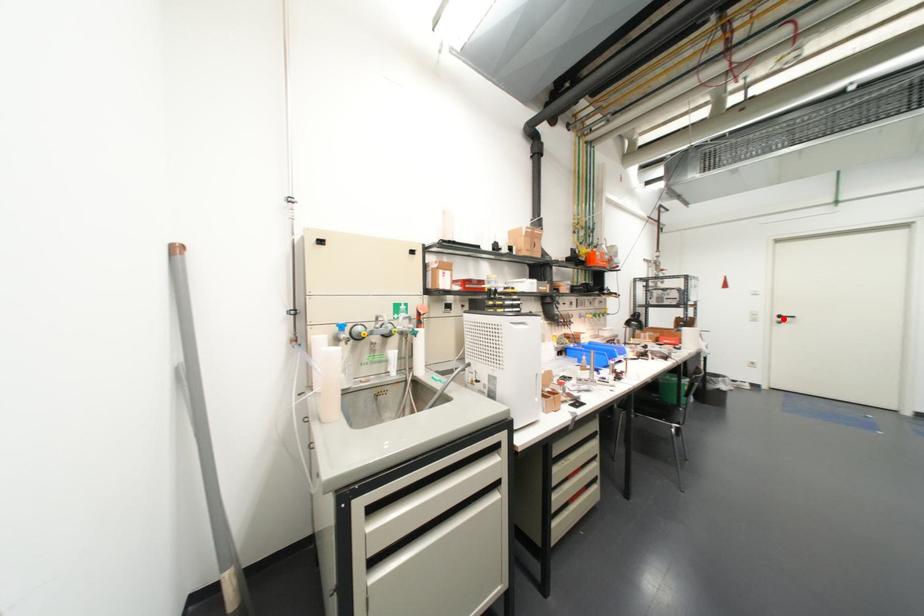
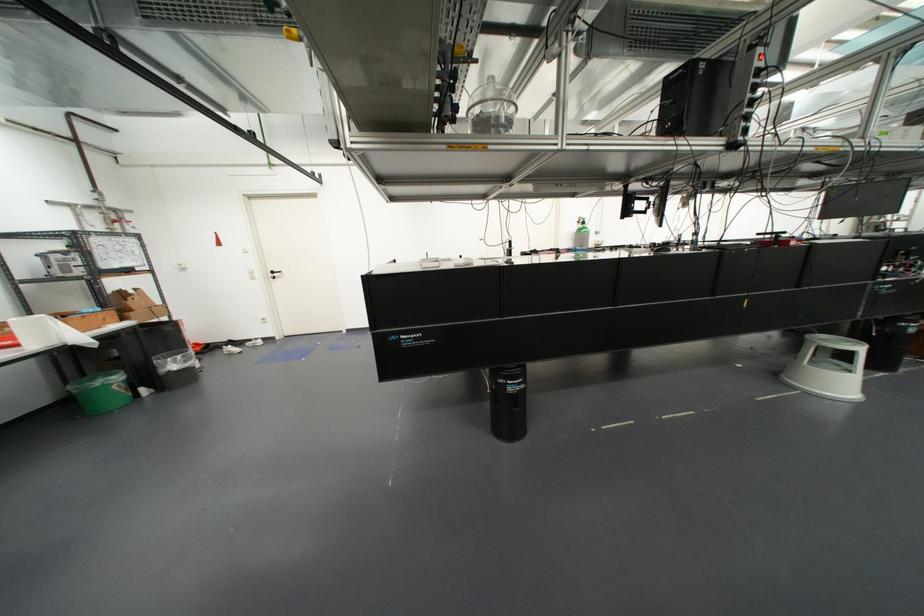
Where in the second image is the point corresponding to the highlighted location from the first image?

(274, 275)